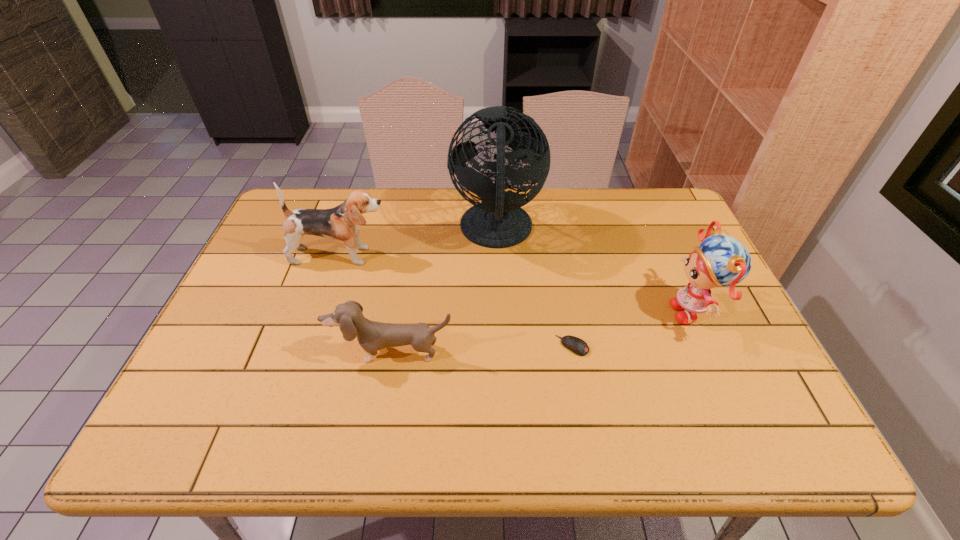
Locate an element on the screen. This screenshot has height=540, width=960. the tallest object is located at coordinates 498,221.

At what (x,y) coordinates should I click in order to perform the action: click on the farther puppy. Please return your answer as a coordinate pair (x, y). Image resolution: width=960 pixels, height=540 pixels. Looking at the image, I should click on (342, 222).

This screenshot has width=960, height=540. In order to click on doll in this screenshot , I will do `click(720, 261)`.

Where is `the nearer puppy`? Image resolution: width=960 pixels, height=540 pixels. the nearer puppy is located at coordinates (372, 336).

The width and height of the screenshot is (960, 540). What are the coordinates of `the fourth tallest object` in the screenshot? It's located at (372, 336).

Locate an element on the screen. the shortest object is located at coordinates (578, 346).

The height and width of the screenshot is (540, 960). Find the location of `free space located on the front-facing side of the tallest object`. free space located on the front-facing side of the tallest object is located at coordinates (365, 231).

The height and width of the screenshot is (540, 960). What are the coordinates of `free space located on the front-facing side of the tallest object` in the screenshot? It's located at (377, 231).

The height and width of the screenshot is (540, 960). Identify the location of vacant space located 0.390m on the front-facing side of the tallest object. (326, 231).

Identify the location of vacant region located 0.320m at the face of the farther puppy. This screenshot has width=960, height=540. (499, 256).